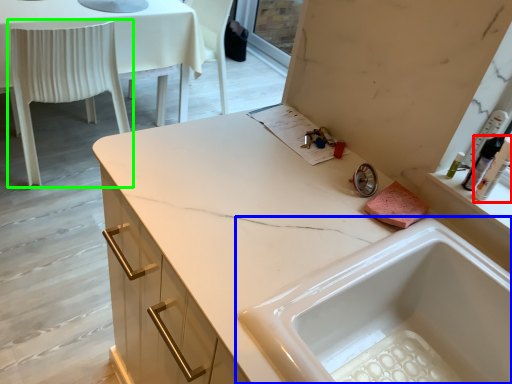
Question: Which object is positioned closest to toiletry (highlighted by a red box)? Select from sink (highlighted by a blue box) and chair (highlighted by a green box).

Choices:
 (A) sink
 (B) chair

Answer: (A)